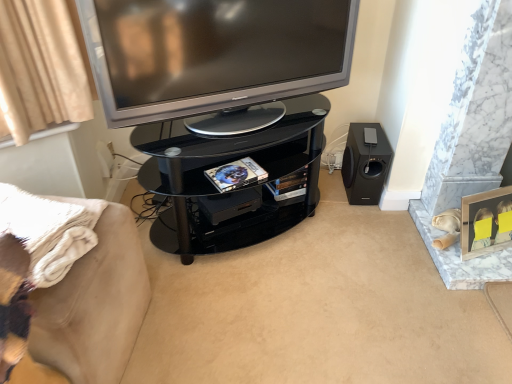
You are a GUI agent. You are given a task and a screenshot of the screen. Output one action in this format:
    pyautogui.click(x=<x>, y=<y>)
    Task: Click on the free location to the right of black glass tv cabinet at center
    
    Given the screenshot: What is the action you would take?
    pyautogui.click(x=370, y=246)